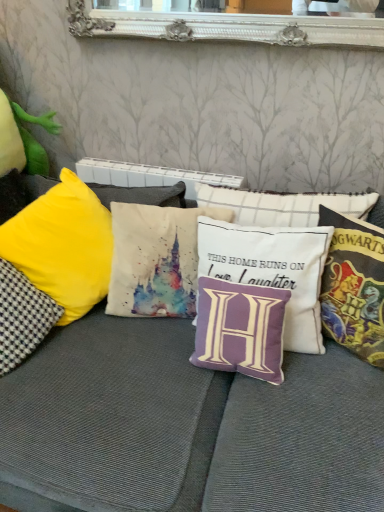
Describe the element at coordinates (143, 421) in the screenshot. I see `velvet cushion at center` at that location.

Identify the location of watercolor fabric castle at center, which is the 2th pillow in left-to-right order. (156, 259).

Find the location of a particular element. The width and height of the screenshot is (384, 512). multicolored fabric hogwarts-themed pillow at right, which ranks as the 5th pillow in left-to-right order is located at coordinates (354, 286).

Measure the distance between point (323, 324) and camera.

Point (323, 324) and camera are 1.37 meters apart from each other.

The width and height of the screenshot is (384, 512). What do you see at coordinates (240, 329) in the screenshot?
I see `purple fabric pillow at center, which is the third pillow from right to left` at bounding box center [240, 329].

Identify the location of velvet cushion at center. (143, 421).

Can we say velvet cushion at center lies outside multicolored fabric hogwarts-themed pillow at right, which ranks as the 5th pillow in left-to-right order?

Yes.

Which object is closer to the camera taking this photo, velvet cushion at center or multicolored fabric hogwarts-themed pillow at right, which ranks as the 5th pillow in left-to-right order?

velvet cushion at center is closer to the camera.

Considering the points (241, 439) and (342, 312), which point is in front, point (241, 439) or point (342, 312)?

The point (241, 439) is more forward.

Is multicolored fabric hogwarts-themed pillow at right, the first pillow from the right, aimed at velvet cushion at center?

Yes, multicolored fabric hogwarts-themed pillow at right, the first pillow from the right, faces towards velvet cushion at center.

From the image's perspective, does multicolored fabric hogwarts-themed pillow at right, which ranks as the 5th pillow in left-to-right order, appear higher than velvet cushion at center?

Yes.

Is multicolored fabric hogwarts-themed pillow at right, which ranks as the 5th pillow in left-to-right order, located outside velvet cushion at center?

Actually, multicolored fabric hogwarts-themed pillow at right, which ranks as the 5th pillow in left-to-right order, is within velvet cushion at center.

Starting from the purple fabric pillow at center, the 4th pillow positioned from the left, which pillow is the 3rd one in front? Please provide its 2D coordinates.

[(354, 286)]

Could you tell me if multicolored fabric hogwarts-themed pillow at right, which ranks as the 5th pillow in left-to-right order, is turned towards purple fabric pillow at center, which is the 2th pillow from right to left?

No, multicolored fabric hogwarts-themed pillow at right, which ranks as the 5th pillow in left-to-right order, does not turn towards purple fabric pillow at center, which is the 2th pillow from right to left.

Between multicolored fabric hogwarts-themed pillow at right, which ranks as the 5th pillow in left-to-right order, and purple fabric pillow at center, the 4th pillow positioned from the left, which one has smaller size?

multicolored fabric hogwarts-themed pillow at right, which ranks as the 5th pillow in left-to-right order.

Considering the relative positions of multicolored fabric hogwarts-themed pillow at right, which ranks as the 5th pillow in left-to-right order, and purple fabric pillow at center, which is the 2th pillow from right to left, in the image provided, is multicolored fabric hogwarts-themed pillow at right, which ranks as the 5th pillow in left-to-right order, to the right of purple fabric pillow at center, which is the 2th pillow from right to left, from the viewer's perspective?

Yes, multicolored fabric hogwarts-themed pillow at right, which ranks as the 5th pillow in left-to-right order, is to the right of purple fabric pillow at center, which is the 2th pillow from right to left.

Is watercolor fabric castle at center, the 4th pillow in the right-to-left sequence, not within yellow fabric pillow at left, the 1th pillow viewed from the left?

watercolor fabric castle at center, the 4th pillow in the right-to-left sequence, lies outside yellow fabric pillow at left, the 1th pillow viewed from the left,'s area.

Is watercolor fabric castle at center, which is the 2th pillow in left-to-right order, positioned with its back to yellow fabric pillow at left, the 1th pillow viewed from the left?

No, watercolor fabric castle at center, which is the 2th pillow in left-to-right order, is not facing the opposite direction of yellow fabric pillow at left, the 1th pillow viewed from the left.

From a real-world perspective, is watercolor fabric castle at center, the 4th pillow in the right-to-left sequence, on yellow fabric pillow at left, the 1th pillow viewed from the left?

Yes.

Is purple fabric pillow at center, which is the 2th pillow from right to left, not within multicolored fabric hogwarts-themed pillow at right, which ranks as the 5th pillow in left-to-right order?

purple fabric pillow at center, which is the 2th pillow from right to left, is positioned outside multicolored fabric hogwarts-themed pillow at right, which ranks as the 5th pillow in left-to-right order.

The image size is (384, 512). What are the coordinates of `the 1st pillow below the purple fabric pillow at center, the 4th pillow positioned from the left (from the image's perspective)` in the screenshot? It's located at (354, 286).

Which object is further away from the camera taking this photo, purple fabric pillow at center, which is the 2th pillow from right to left, or multicolored fabric hogwarts-themed pillow at right, the first pillow from the right?

purple fabric pillow at center, which is the 2th pillow from right to left, is more distant.

Is the depth of velvet cushion at center less than that of purple fabric pillow at center, which is the third pillow from right to left?

Yes, velvet cushion at center is closer to the camera.

Which object is positioned more to the right, velvet cushion at center or purple fabric pillow at center, which is the third pillow from right to left?

Positioned to the right is purple fabric pillow at center, which is the third pillow from right to left.

Does velvet cushion at center have a lesser height compared to purple fabric pillow at center, which is counted as the 3th pillow, starting from the left?

In fact, velvet cushion at center may be taller than purple fabric pillow at center, which is counted as the 3th pillow, starting from the left.

Does velvet cushion at center contain purple fabric pillow at center, which is counted as the 3th pillow, starting from the left?

Absolutely, purple fabric pillow at center, which is counted as the 3th pillow, starting from the left, is inside velvet cushion at center.

Is yellow fabric pillow at left, the 5th pillow from the right, to the right of multicolored fabric hogwarts-themed pillow at right, the first pillow from the right, from the viewer's perspective?

No.

How distant is yellow fabric pillow at left, the 5th pillow from the right, from multicolored fabric hogwarts-themed pillow at right, which ranks as the 5th pillow in left-to-right order?

yellow fabric pillow at left, the 5th pillow from the right, and multicolored fabric hogwarts-themed pillow at right, which ranks as the 5th pillow in left-to-right order, are 38.04 inches apart.

Does yellow fabric pillow at left, the 1th pillow viewed from the left, have a lesser width compared to multicolored fabric hogwarts-themed pillow at right, which ranks as the 5th pillow in left-to-right order?

Incorrect, the width of yellow fabric pillow at left, the 1th pillow viewed from the left, is not less than that of multicolored fabric hogwarts-themed pillow at right, which ranks as the 5th pillow in left-to-right order.

Looking at this image, from a real-world perspective, is yellow fabric pillow at left, the 5th pillow from the right, physically below multicolored fabric hogwarts-themed pillow at right, which ranks as the 5th pillow in left-to-right order?

Indeed, from a real-world perspective, yellow fabric pillow at left, the 5th pillow from the right, is positioned beneath multicolored fabric hogwarts-themed pillow at right, which ranks as the 5th pillow in left-to-right order.

Find the location of a particular element. The width and height of the screenshot is (384, 512). the 1st pillow behind when counting from the velvet cushion at center is located at coordinates (354, 286).

Where is `studio couch in front of the multicolored fabric hogwarts-themed pillow at right, which ranks as the 5th pillow in left-to-right order`? studio couch in front of the multicolored fabric hogwarts-themed pillow at right, which ranks as the 5th pillow in left-to-right order is located at coordinates (143, 421).

Which object lies further to the anchor point multicolored fabric hogwarts-themed pillow at right, which ranks as the 5th pillow in left-to-right order, yellow fabric pillow at left, the 5th pillow from the right, or purple fabric pillow at center, the 4th pillow positioned from the left?

yellow fabric pillow at left, the 5th pillow from the right.

Considering their positions, is watercolor fabric castle at center, the 4th pillow in the right-to-left sequence, positioned further to velvet cushion at center than multicolored fabric hogwarts-themed pillow at right, the first pillow from the right?

multicolored fabric hogwarts-themed pillow at right, the first pillow from the right.

Looking at the image, which one is located further to velvet cushion at center, yellow fabric pillow at left, the 5th pillow from the right, or purple fabric pillow at center, which is the 2th pillow from right to left?

Based on the image, purple fabric pillow at center, which is the 2th pillow from right to left, appears to be further to velvet cushion at center.

Which object lies nearer to the anchor point multicolored fabric hogwarts-themed pillow at right, the first pillow from the right, velvet cushion at center or purple fabric pillow at center, which is counted as the 3th pillow, starting from the left?

purple fabric pillow at center, which is counted as the 3th pillow, starting from the left, is closer to multicolored fabric hogwarts-themed pillow at right, the first pillow from the right.

Considering their positions, is watercolor fabric castle at center, which is the 2th pillow in left-to-right order, positioned further to velvet cushion at center than purple fabric pillow at center, which is counted as the 3th pillow, starting from the left?

watercolor fabric castle at center, which is the 2th pillow in left-to-right order, is further to velvet cushion at center.

Considering their positions, is purple fabric pillow at center, which is the third pillow from right to left, positioned closer to multicolored fabric hogwarts-themed pillow at right, the first pillow from the right, than velvet cushion at center?

purple fabric pillow at center, which is the third pillow from right to left, is closer to multicolored fabric hogwarts-themed pillow at right, the first pillow from the right.

Which object lies further to the anchor point watercolor fabric castle at center, which is the 2th pillow in left-to-right order, yellow fabric pillow at left, the 5th pillow from the right, or multicolored fabric hogwarts-themed pillow at right, the first pillow from the right?

Among the two, multicolored fabric hogwarts-themed pillow at right, the first pillow from the right, is located further to watercolor fabric castle at center, which is the 2th pillow in left-to-right order.

Which object lies nearer to the anchor point purple fabric pillow at center, which is the 2th pillow from right to left, yellow fabric pillow at left, the 5th pillow from the right, or purple fabric pillow at center, which is the third pillow from right to left?

Among the two, purple fabric pillow at center, which is the third pillow from right to left, is located nearer to purple fabric pillow at center, which is the 2th pillow from right to left.

Where is `pillow situated between yellow fabric pillow at left, the 1th pillow viewed from the left, and purple fabric pillow at center, which is the third pillow from right to left, from left to right`? The width and height of the screenshot is (384, 512). pillow situated between yellow fabric pillow at left, the 1th pillow viewed from the left, and purple fabric pillow at center, which is the third pillow from right to left, from left to right is located at coordinates (156, 259).

Locate an element on the screen. Image resolution: width=384 pixels, height=512 pixels. studio couch situated between yellow fabric pillow at left, the 5th pillow from the right, and purple fabric pillow at center, which is the 2th pillow from right to left, from left to right is located at coordinates (143, 421).

Identify the location of pillow situated between watercolor fabric castle at center, the 4th pillow in the right-to-left sequence, and purple fabric pillow at center, the 4th pillow positioned from the left, from left to right. This screenshot has height=512, width=384. (240, 329).

Image resolution: width=384 pixels, height=512 pixels. I want to click on pillow between purple fabric pillow at center, which is counted as the 3th pillow, starting from the left, and multicolored fabric hogwarts-themed pillow at right, the first pillow from the right, so click(272, 269).